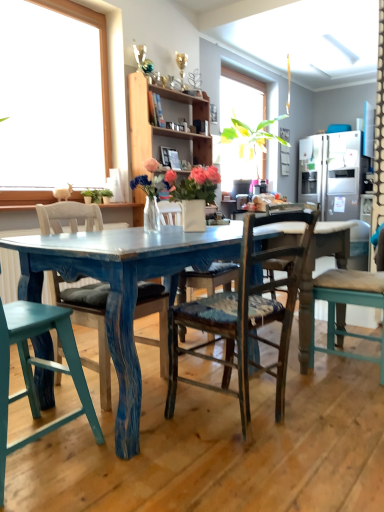
Question: Considering the positions of satin silver refrigerator at right and distressed teal chair at center, placed as the 3th chair when sorted from right to left, in the image, is satin silver refrigerator at right wider or thinner than distressed teal chair at center, placed as the 3th chair when sorted from right to left,?

Choices:
 (A) thin
 (B) wide

Answer: (B)

Question: Would you say satin silver refrigerator at right is inside or outside distressed teal chair at center, placed as the 3th chair when sorted from right to left?

Choices:
 (A) inside
 (B) outside

Answer: (B)

Question: Estimate the real-world distances between objects in this image. Which object is closer to the wooden chair with cushion at right, the 1th chair positioned from the right?

Choices:
 (A) worn wood chair at center, placed as the second chair when sorted from right to left
 (B) matte white vase at center
 (C) satin silver refrigerator at right
 (D) teal wood chair at lower left, which is the 4th chair in right-to-left order
 (E) wooden shelf at upper center

Answer: (A)

Question: Which is farther from the wooden shelf at upper center?

Choices:
 (A) matte white vase at center
 (B) wooden chair with cushion at right, the 1th chair positioned from the right
 (C) distressed teal chair at center, arranged as the 2th chair when viewed from the left
 (D) satin silver refrigerator at right
 (E) worn wood chair at center, which is counted as the third chair, starting from the left

Answer: (E)